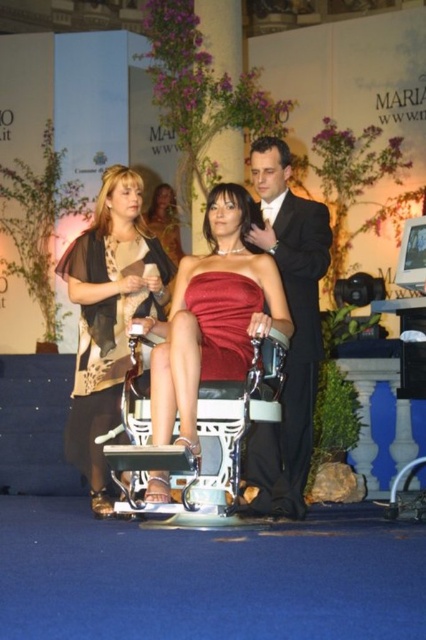
Question: Is matte beige dress at center to the left of satin red dress at center from the viewer's perspective?

Choices:
 (A) yes
 (B) no

Answer: (A)

Question: Does shiny red dress at center have a larger size compared to satin red dress at center?

Choices:
 (A) no
 (B) yes

Answer: (B)

Question: Considering the real-world distances, which object is farthest from the black satin suit at center?

Choices:
 (A) satin red dress at center
 (B) metallic silver chair at center
 (C) matte beige dress at center

Answer: (C)

Question: Is matte beige dress at center thinner than satin red dress at center?

Choices:
 (A) yes
 (B) no

Answer: (B)

Question: Estimate the real-world distances between objects in this image. Which object is closer to the matte beige dress at center?

Choices:
 (A) shiny red dress at center
 (B) black satin suit at center
 (C) satin red dress at center

Answer: (A)

Question: Which of the following is the closest to the observer?

Choices:
 (A) (152, 230)
 (B) (149, 460)
 (C) (244, 307)

Answer: (B)